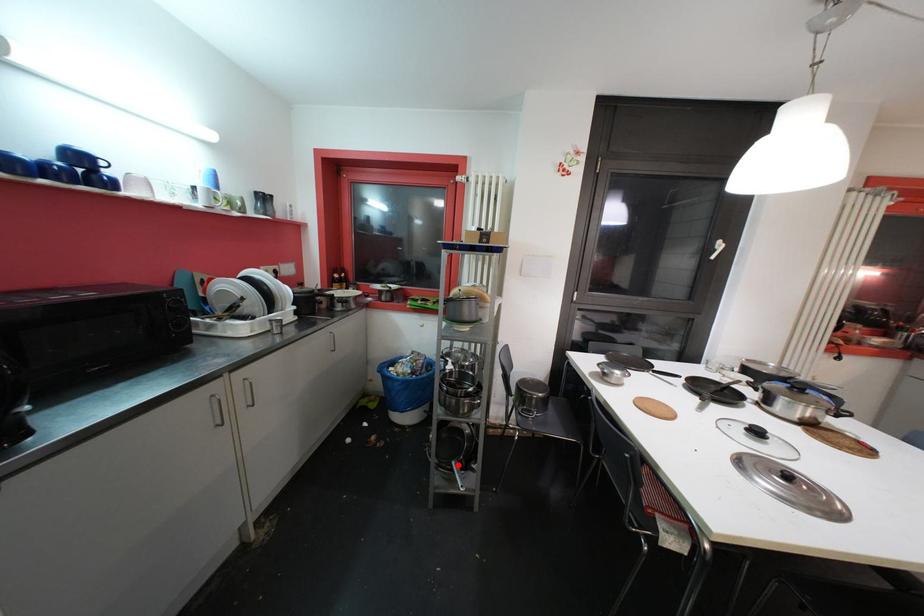
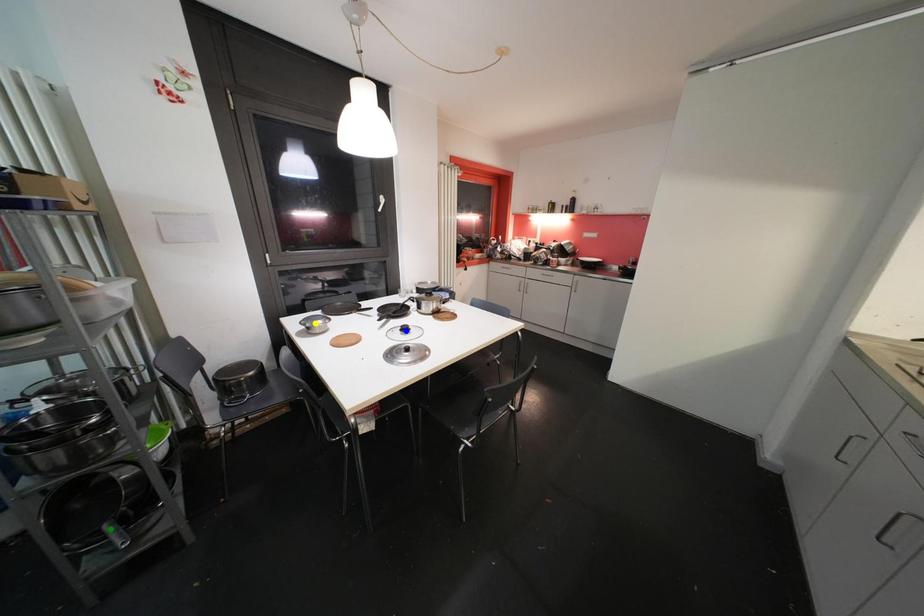
Question: I am providing you with two images of the same scene from different viewpoints. A red point is marked on the first image. You are given multiple points on the second image. Which spot in image 2 lines up with the point in image 1?

Choices:
 (A) green point
 (B) yellow point
 (C) blue point

Answer: (A)